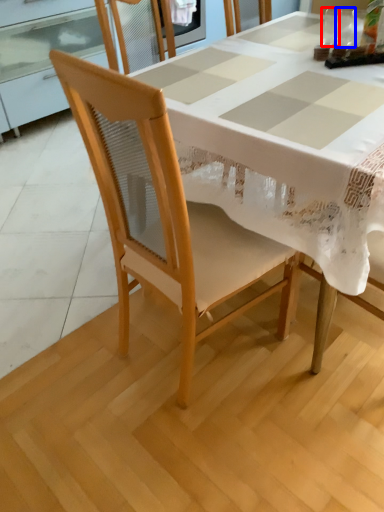
Question: Which object is further to the camera taking this photo, tableware (highlighted by a red box) or tableware (highlighted by a blue box)?

Choices:
 (A) tableware
 (B) tableware

Answer: (B)